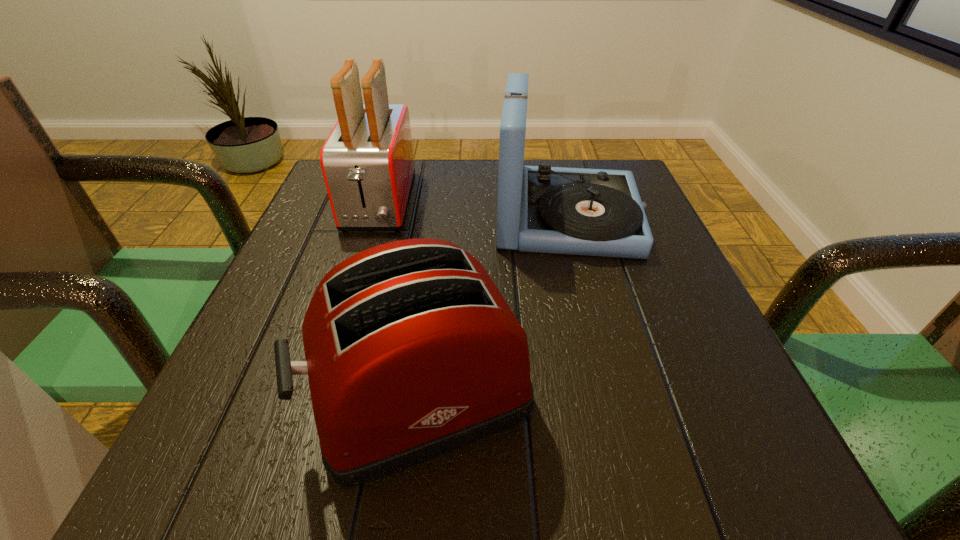
The image size is (960, 540). I want to click on object positioned at the right edge, so pyautogui.click(x=597, y=212).

Where is `object located in the far left corner section of the desktop`? object located in the far left corner section of the desktop is located at coordinates (367, 161).

Find the location of a particular element. Image resolution: width=960 pixels, height=540 pixels. object that is at the near left corner is located at coordinates (411, 351).

The width and height of the screenshot is (960, 540). I want to click on object situated at the far right corner, so click(x=597, y=212).

The image size is (960, 540). I want to click on free region at the far edge of the desktop, so pyautogui.click(x=492, y=161).

In order to click on free space at the near edge of the desktop in this screenshot , I will do `click(398, 476)`.

In the image, there is a desktop. In order to click on blank space at the left edge in this screenshot , I will do `click(312, 246)`.

The height and width of the screenshot is (540, 960). Identify the location of free space at the right edge of the desktop. (631, 273).

This screenshot has width=960, height=540. In order to click on free region at the far left corner in this screenshot , I will do [332, 211].

This screenshot has height=540, width=960. I want to click on free space at the far right corner of the desktop, so click(x=563, y=165).